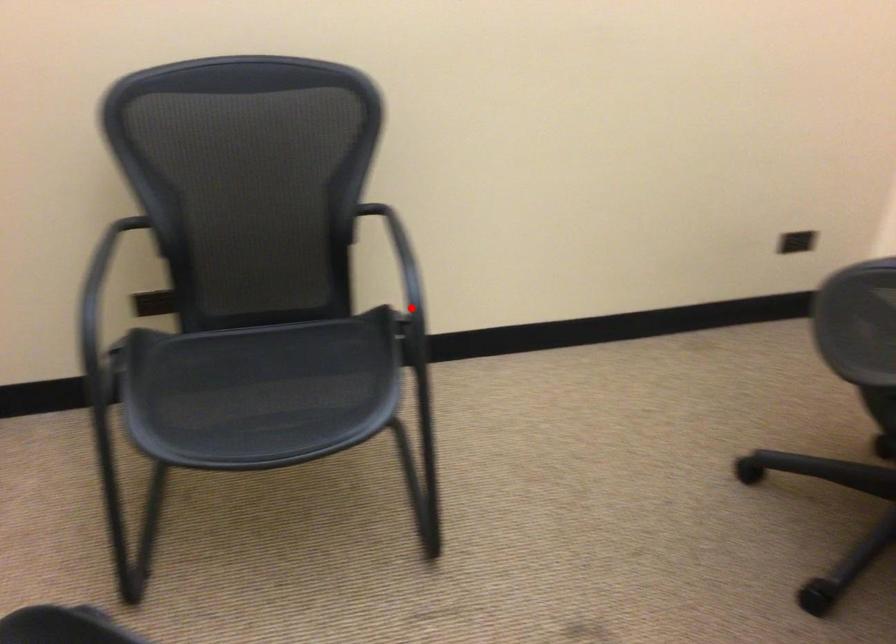
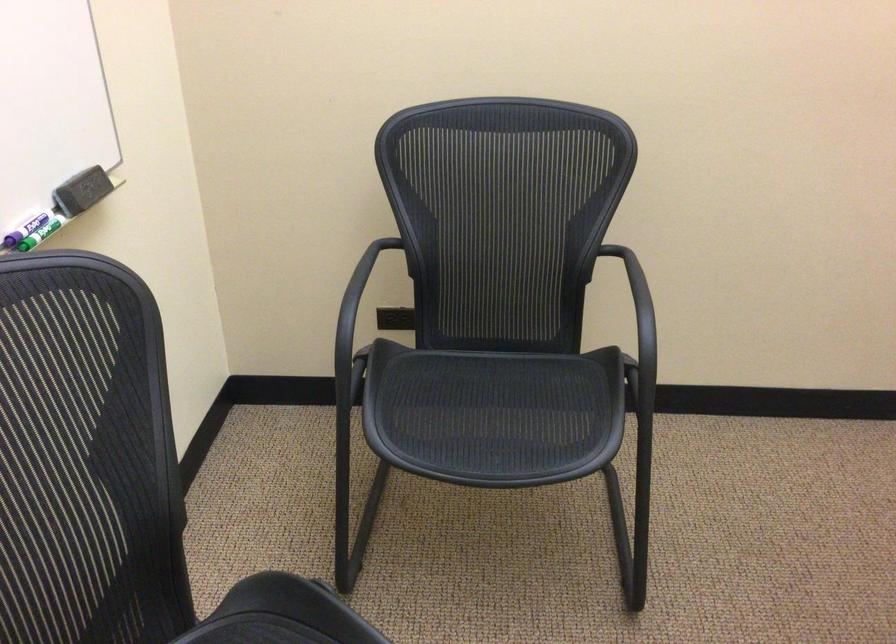
In the second image, find the point that corresponds to the highlighted location in the first image.

(639, 348)